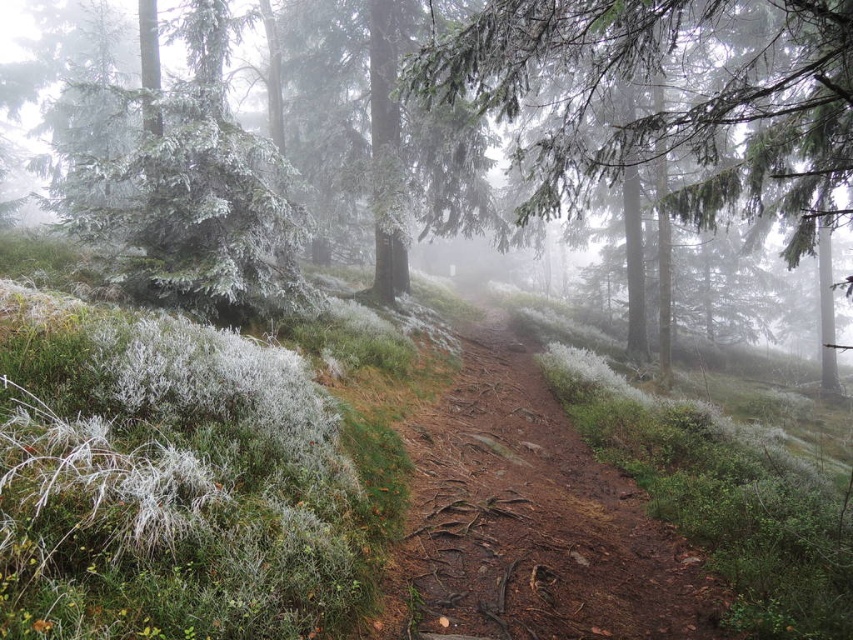
Can you confirm if dirt path at center is taller than frosted evergreen tree at upper left?

In fact, dirt path at center may be shorter than frosted evergreen tree at upper left.

Is point (657, 548) positioned behind point (137, 230)?

No, it is not.

Where is `dirt path at center`? This screenshot has height=640, width=853. dirt path at center is located at coordinates (529, 522).

Does dirt path at center have a lesser height compared to frosted evergreen tree at center?

Correct, dirt path at center is not as tall as frosted evergreen tree at center.

Between point (572, 442) and point (22, 132), which one is positioned behind?

Point (22, 132)

You are a GUI agent. You are given a task and a screenshot of the screen. Output one action in this format:
    pyautogui.click(x=<x>, y=<y>)
    Task: Click on the dirt path at center
    The height and width of the screenshot is (640, 853).
    Given the screenshot: What is the action you would take?
    pyautogui.click(x=529, y=522)

Who is higher up, frosted evergreen tree at upper left or frosted evergreen tree at center?

frosted evergreen tree at center

What do you see at coordinates (193, 192) in the screenshot? I see `frosted evergreen tree at upper left` at bounding box center [193, 192].

Locate an element on the screen. The height and width of the screenshot is (640, 853). frosted evergreen tree at upper left is located at coordinates (193, 192).